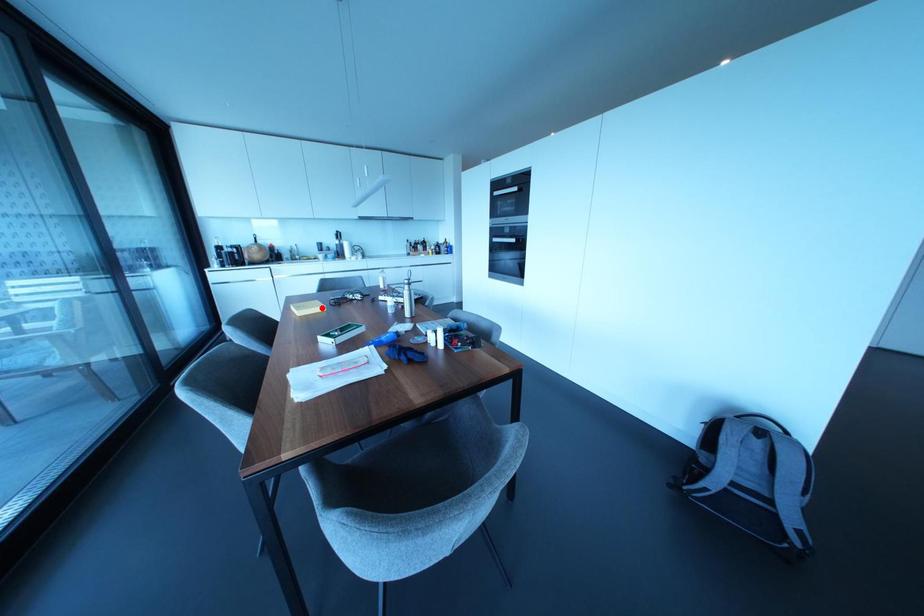
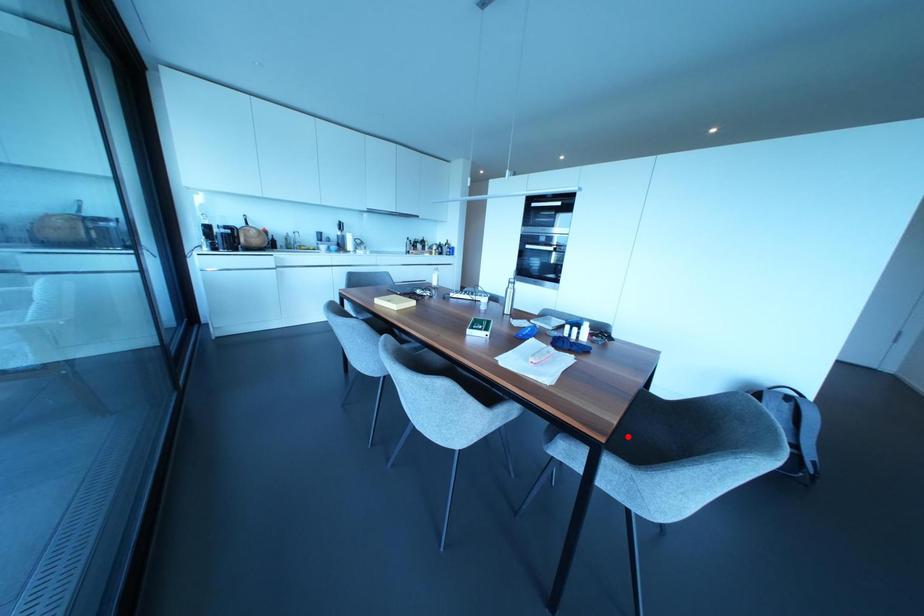
I am providing you with two images of the same scene from different viewpoints. A red point is marked on the first image and another point is marked on the second image. Are the points marked in image1 and image2 representing the same 3D position?

No